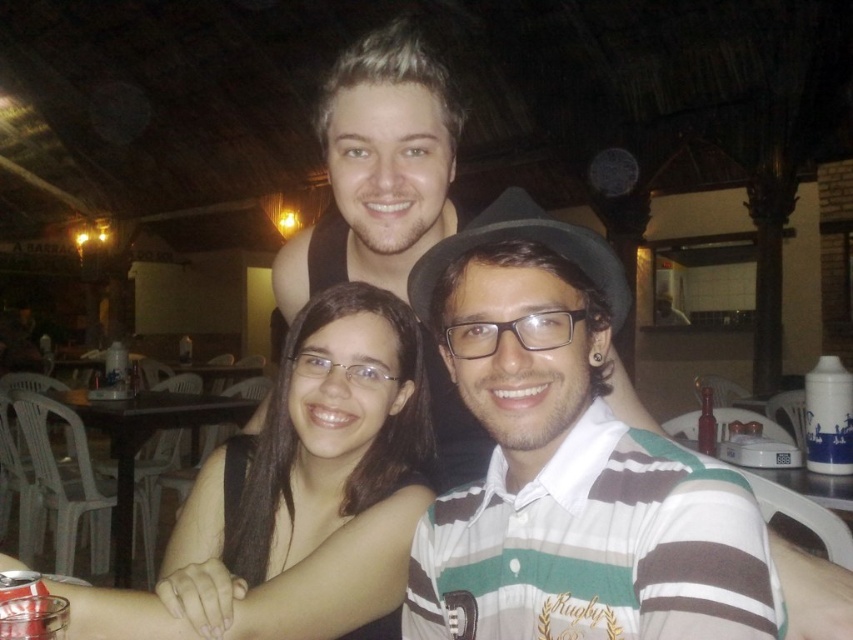
Can you confirm if striped cotton shirt at center is positioned to the left of black matte hair at center?

No, striped cotton shirt at center is not to the left of black matte hair at center.

Can you confirm if striped cotton shirt at center is positioned below black matte hair at center?

No.

What do you see at coordinates (569, 465) in the screenshot? The height and width of the screenshot is (640, 853). I see `striped cotton shirt at center` at bounding box center [569, 465].

I want to click on striped cotton shirt at center, so click(569, 465).

Is striped cotton shirt at center in front of black plastic table at lower left?

Yes, it is.

Is striped cotton shirt at center shorter than black plastic table at lower left?

Indeed, striped cotton shirt at center has a lesser height compared to black plastic table at lower left.

What do you see at coordinates (569, 465) in the screenshot? I see `striped cotton shirt at center` at bounding box center [569, 465].

This screenshot has height=640, width=853. I want to click on striped cotton shirt at center, so click(569, 465).

Does black matte hair at center appear on the left side of black plastic table at lower left?

In fact, black matte hair at center is to the right of black plastic table at lower left.

Who is more distant from viewer, (401,477) or (70,401)?

Point (70,401)

Is point (369, 300) positioned in front of point (126, 412)?

Yes, it is in front of point (126, 412).

Locate an element on the screen. The width and height of the screenshot is (853, 640). black matte hair at center is located at coordinates (306, 452).